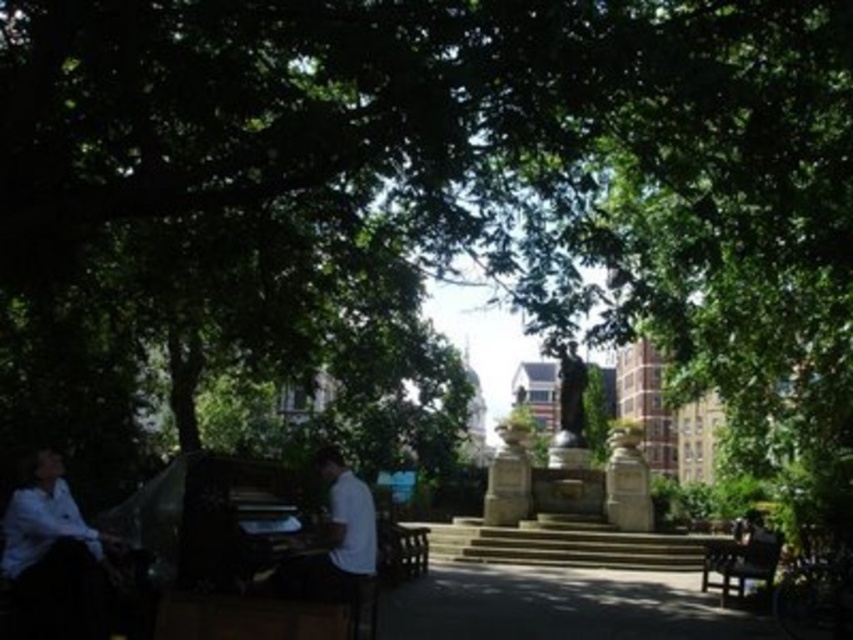
Is white matte shirt at lower left above white matte shirt at center?

Correct, white matte shirt at lower left is located above white matte shirt at center.

Identify the location of white matte shirt at lower left. The height and width of the screenshot is (640, 853). [53, 556].

Image resolution: width=853 pixels, height=640 pixels. I want to click on white matte shirt at lower left, so click(53, 556).

Is white matte shirt at center to the right of dark brown wooden bench at lower right from the viewer's perspective?

No, white matte shirt at center is not to the right of dark brown wooden bench at lower right.

Is point (346, 538) closer to camera compared to point (775, 534)?

Yes.

What are the coordinates of `white matte shirt at center` in the screenshot? It's located at (341, 532).

Does white matte shirt at lower left have a smaller size compared to dark brown wooden bench at lower right?

Yes, white matte shirt at lower left is smaller than dark brown wooden bench at lower right.

Measure the distance between white matte shirt at lower left and dark brown wooden bench at lower right.

A distance of 135.30 meters exists between white matte shirt at lower left and dark brown wooden bench at lower right.

This screenshot has width=853, height=640. Find the location of `white matte shirt at lower left`. white matte shirt at lower left is located at coordinates (53, 556).